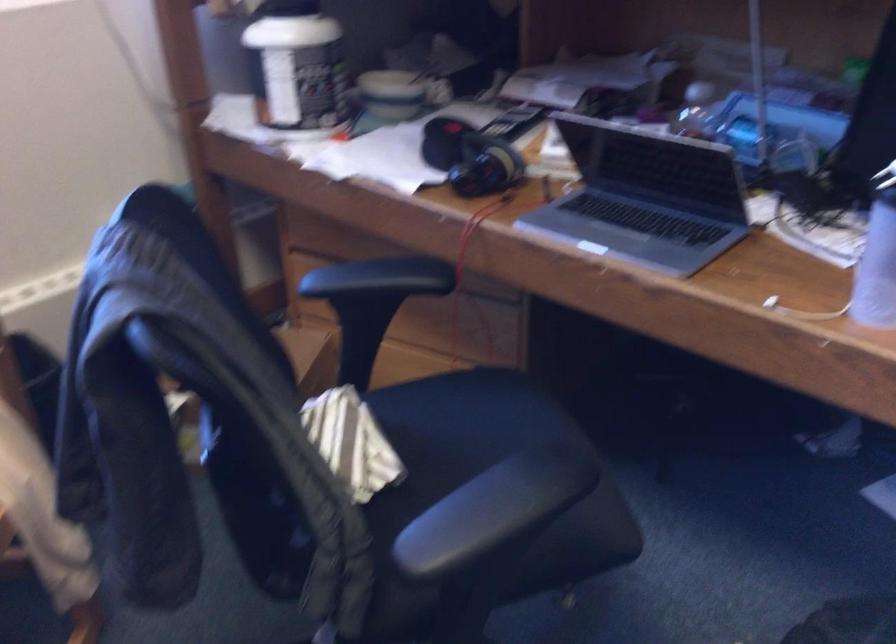
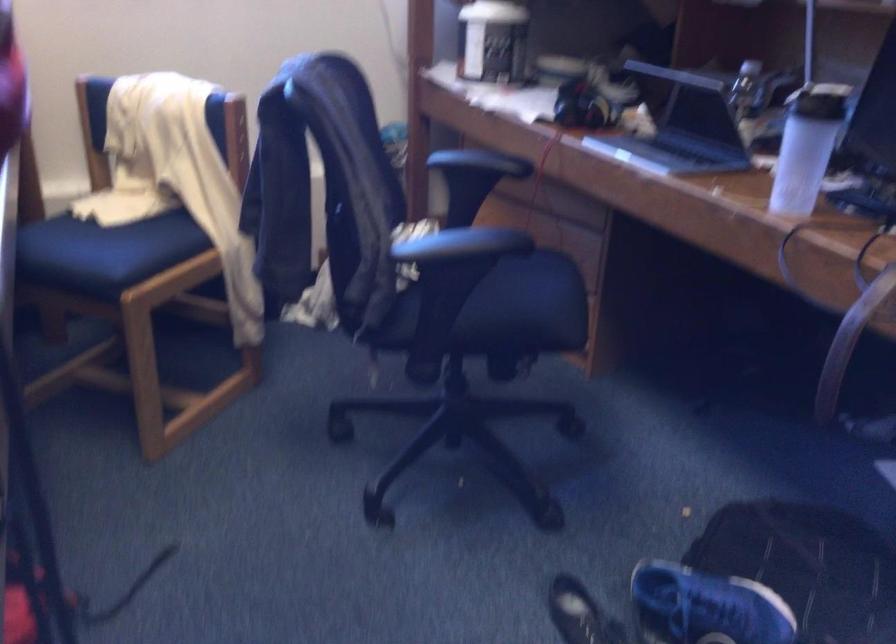
In the second image, find the point that corresponds to point (359, 281) in the first image.

(466, 158)